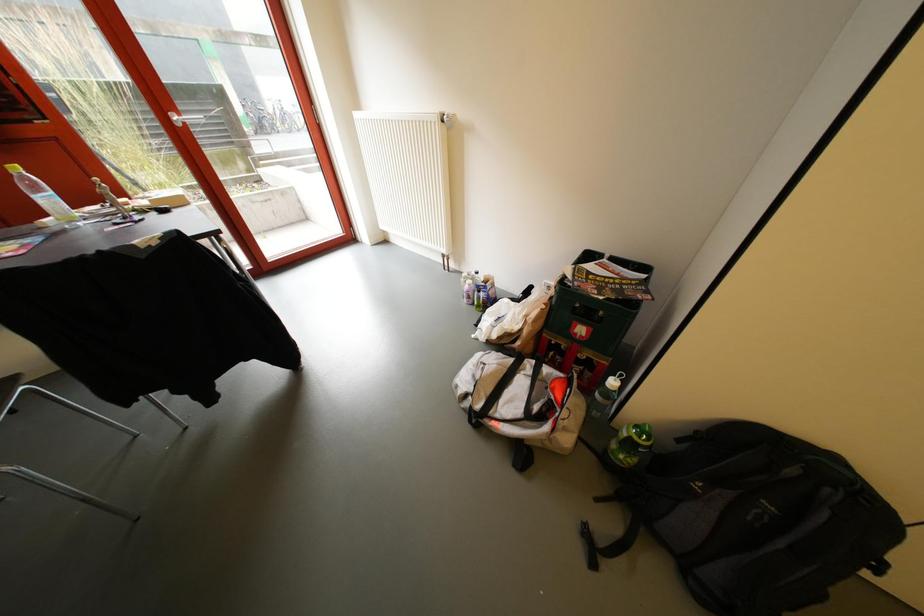
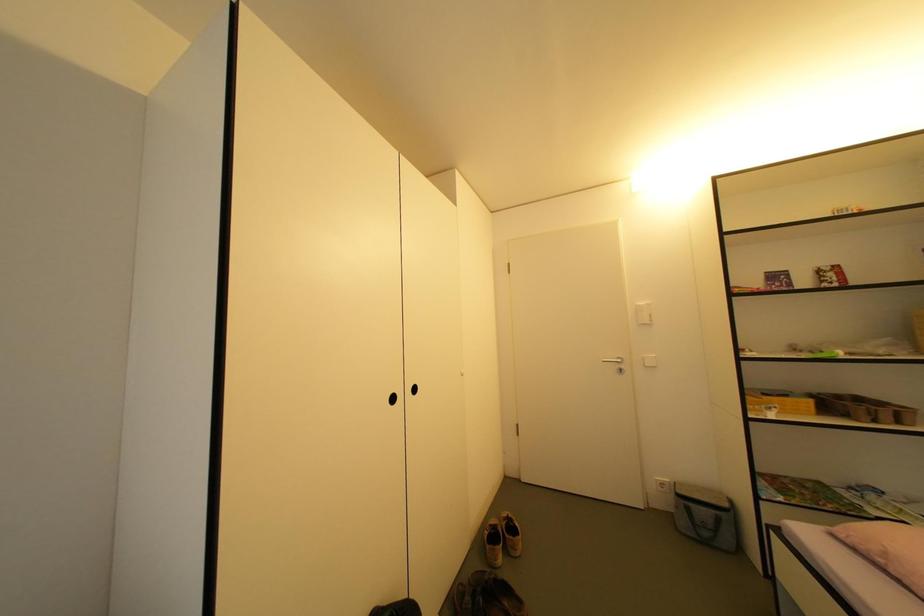
Question: The first image is from the beginning of the video and the second image is from the end. How did the camera likely rotate when shooting the video?

Choices:
 (A) Left
 (B) Right
 (C) Up
 (D) Down

Answer: (B)